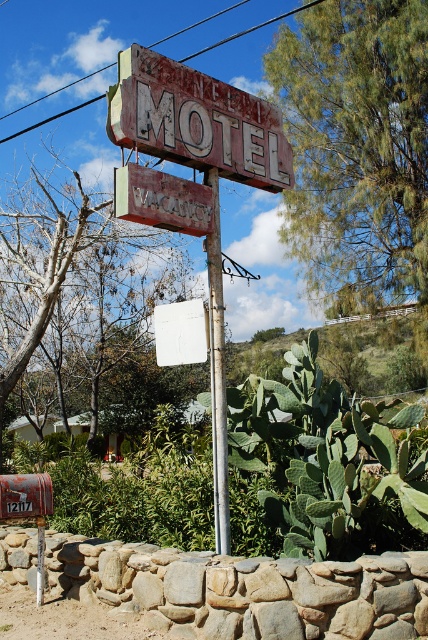
Which of these two, wooden signboard at center or metallic pole at center, stands shorter?

wooden signboard at center is shorter.

Does wooden signboard at center appear on the right side of metallic pole at center?

No, wooden signboard at center is not to the right of metallic pole at center.

Locate an element on the screen. The image size is (428, 640). wooden signboard at center is located at coordinates (163, 198).

Measure the distance between rusty metal motel sign at upper center and camera.

A distance of 6.23 meters exists between rusty metal motel sign at upper center and camera.

Is point (131, 72) positioned after point (223, 525)?

No, (131, 72) is in front of (223, 525).

Identify the location of rusty metal motel sign at upper center. (196, 120).

Is rusty metal motel sign at upper center to the right of wooden signboard at center from the viewer's perspective?

Correct, you'll find rusty metal motel sign at upper center to the right of wooden signboard at center.

Where is `rusty metal motel sign at upper center`? Image resolution: width=428 pixels, height=640 pixels. rusty metal motel sign at upper center is located at coordinates [196, 120].